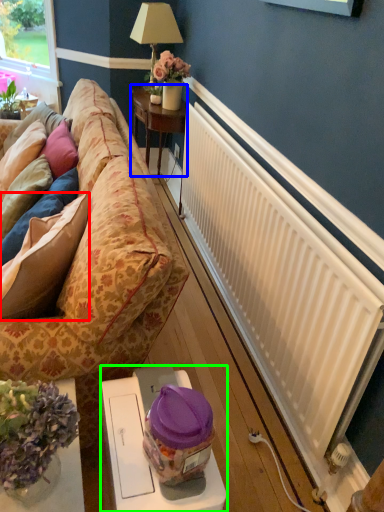
Question: Estimate the real-world distances between objects in this image. Which object is closer to pillow (highlighted by a red box), table (highlighted by a blue box) or table (highlighted by a green box)?

Choices:
 (A) table
 (B) table

Answer: (B)